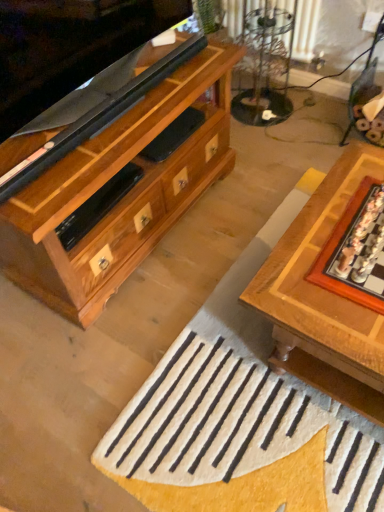
In order to click on vacant space to the left of wooden board game at right in this screenshot , I will do `click(312, 279)`.